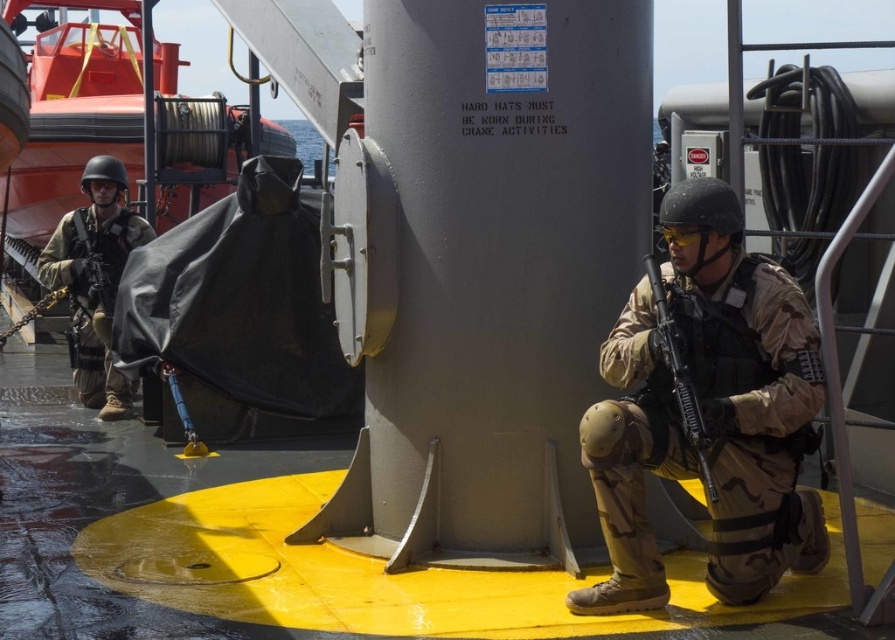
You are a new crew member on the ship and need to locate the lifeboat. You see the camouflage fabric uniform at left and the brushed metal lifeboat at left. Which object is positioned to the left of the other?

The brushed metal lifeboat at left is positioned to the left of the camouflage fabric uniform at left.

You are a drone operator observing the deck of a naval ship. You need to determine which of the two points, point (713, 564) or point (47, 113), is closer to you. Which point is closer?

Point (713, 564) is closer to the viewer than point (47, 113).

You are a crew member on the ship and need to quickly access the brushed metal lifeboat at left. However, there is a camouflage fabric uniform at left in your path. Based on their positions, can you reach the lifeboat without moving the uniform?

The brushed metal lifeboat at left is in front of the camouflage fabric uniform at left, so you can reach the lifeboat without moving the uniform because it is closer to you.